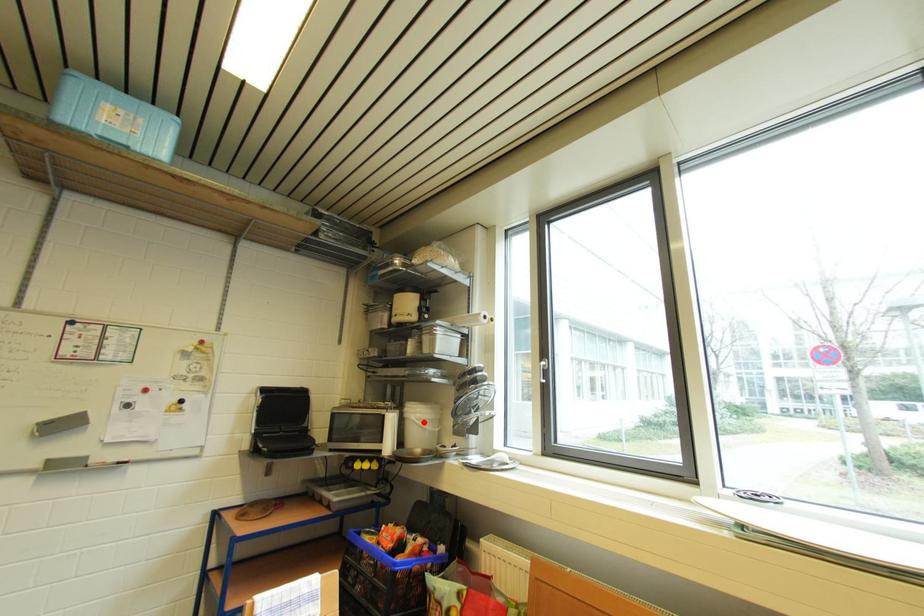
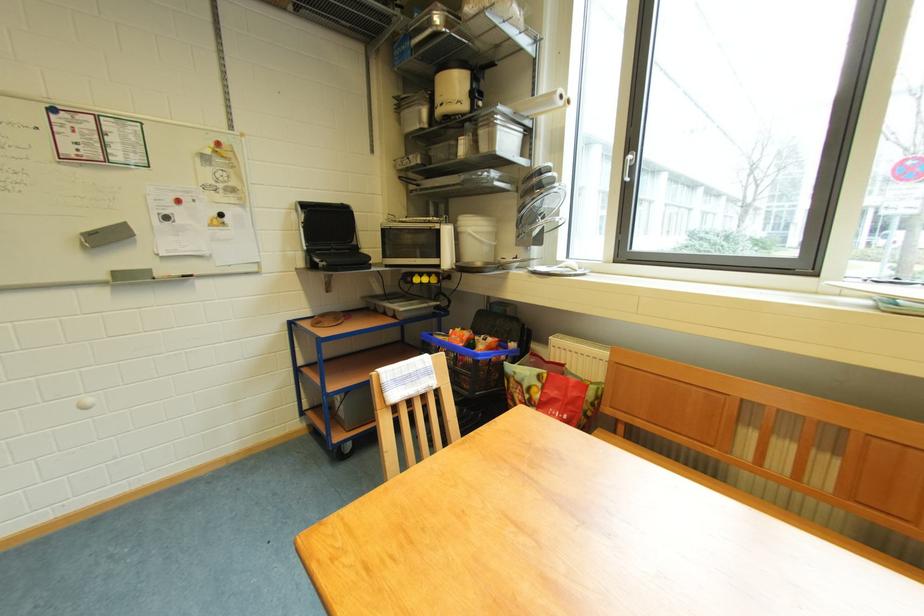
Question: I am providing you with two images of the same scene from different viewpoints. A red point is shown in image1. For the corresponding object point in image2, is it positioned nearer or farther from the camera?

Choices:
 (A) Nearer
 (B) Farther

Answer: (A)